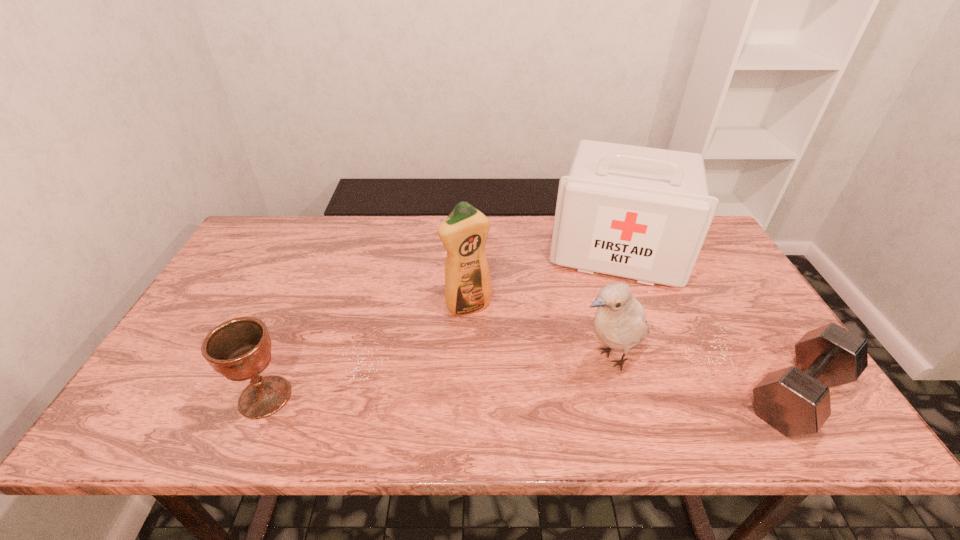
Point out which object is positioned as the second nearest to the fourth tallest object. Please provide its 2D coordinates. Your answer should be formatted as a tuple, i.e. [(x, y)], where the tuple contains the x and y coordinates of a point satisfying the conditions above.

[(620, 323)]

The height and width of the screenshot is (540, 960). I want to click on vacant region that satisfies the following two spatial constraints: 1. on the back side of the farthest object; 2. on the left side of the leftmost object, so click(x=328, y=250).

I want to click on vacant space that satisfies the following two spatial constraints: 1. on the front side of the dumbbell; 2. on the right side of the first-aid kit, so click(x=671, y=394).

Locate an element on the screen. vacant space that satisfies the following two spatial constraints: 1. on the back side of the second shortest object; 2. on the left side of the third shortest object is located at coordinates (282, 356).